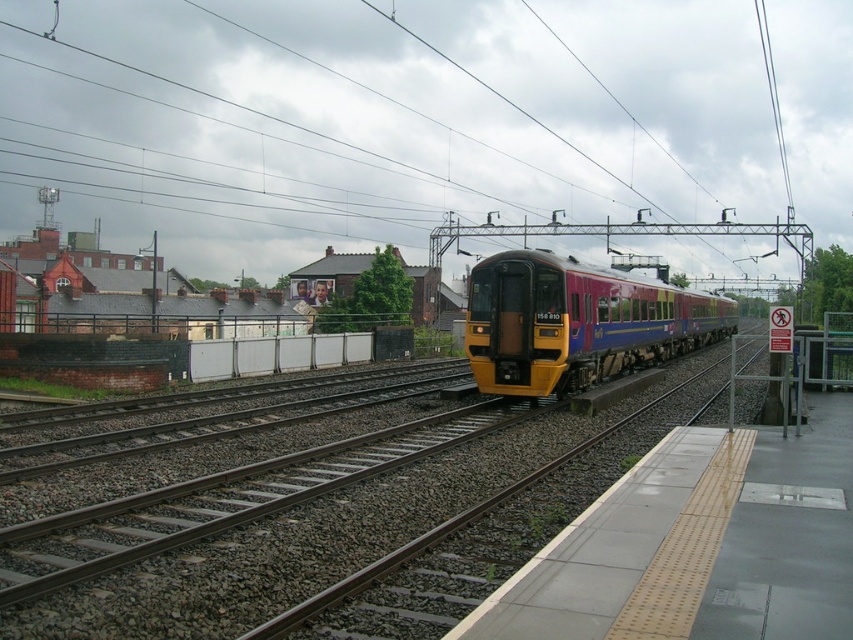
Question: Which of the following is the closest to the observer?

Choices:
 (A) (128, 52)
 (B) (612, 372)

Answer: (B)

Question: Can you confirm if metallic wires at upper center is positioned above yellow metallic train at center?

Choices:
 (A) no
 (B) yes

Answer: (B)

Question: Among these points, which one is nearest to the camera?

Choices:
 (A) (474, 60)
 (B) (514, 259)

Answer: (B)

Question: From the image, what is the correct spatial relationship of metallic wires at upper center in relation to yellow metallic train at center?

Choices:
 (A) right
 (B) left

Answer: (B)

Question: Which of the following is the closest to the observer?

Choices:
 (A) (486, 122)
 (B) (643, 355)

Answer: (B)

Question: Where is metallic wires at upper center located in relation to yellow metallic train at center in the image?

Choices:
 (A) below
 (B) above

Answer: (B)